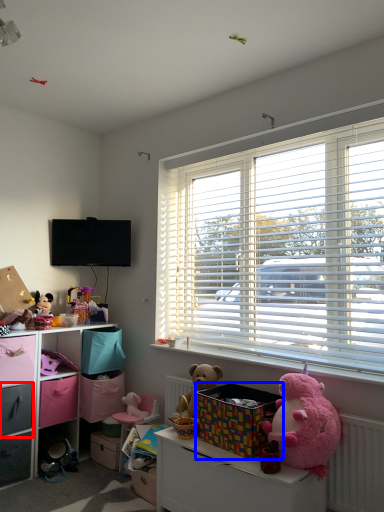
Question: Which object is further to the camera taking this photo, drawer (highlighted by a red box) or storage box (highlighted by a blue box)?

Choices:
 (A) drawer
 (B) storage box

Answer: (A)